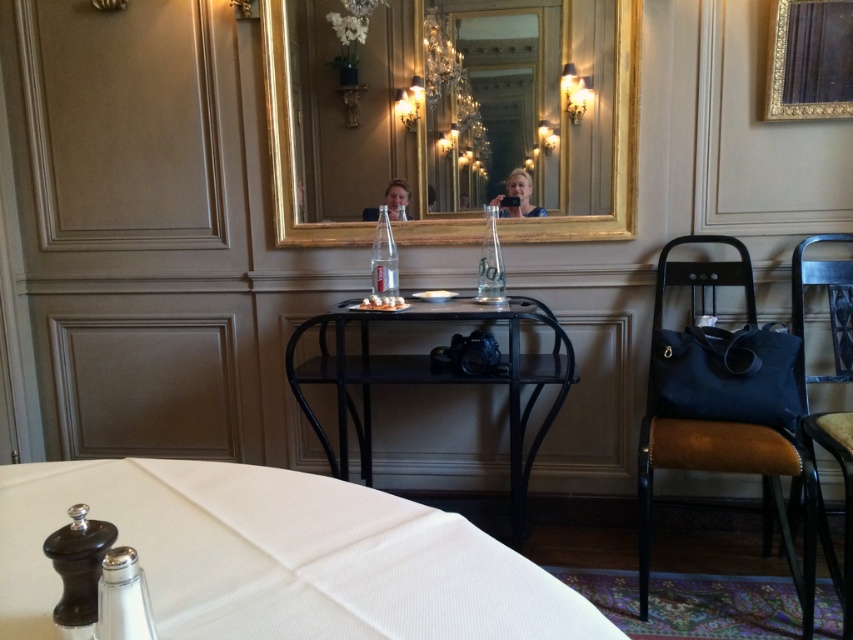
You are a guest at this venue and need to place the matte plastic water bottle at center onto the leather brown chair at right. Is the bottle likely to fit on the chair?

The leather brown chair at right is much taller than the matte plastic water bottle at center, so the bottle is likely too short to reach the seating area of the chair. It might not be stable or practical to place the bottle there.

You are a guest at this elegant dining area and want to place a small decorative item on the white fabric tablecloth at lower center. However, you need to ensure it won not be knocked over by the matte plastic water bottle at center. Is the tablecloth high enough to prevent this?

The white fabric tablecloth at lower center has a lesser height compared to the matte plastic water bottle at center. Since the tablecloth is shorter, placing an item there might still be at risk of being knocked over by the taller water bottle.

You are a guest at this elegant dining area and want to place a small decorative item on the table. Considering the white fabric tablecloth at lower center and the matte plastic water bottle at center, which object has enough space to accommodate the item?

The white fabric tablecloth at lower center has a larger width than the matte plastic water bottle at center, so the item can be placed on the white fabric tablecloth at lower center.